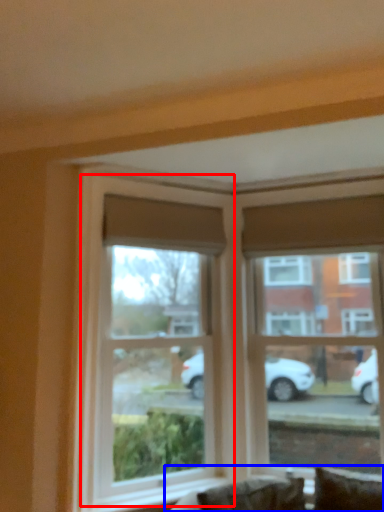
Question: Which object appears farthest to the camera in this image, window (highlighted by a red box) or couch (highlighted by a blue box)?

Choices:
 (A) window
 (B) couch

Answer: (A)